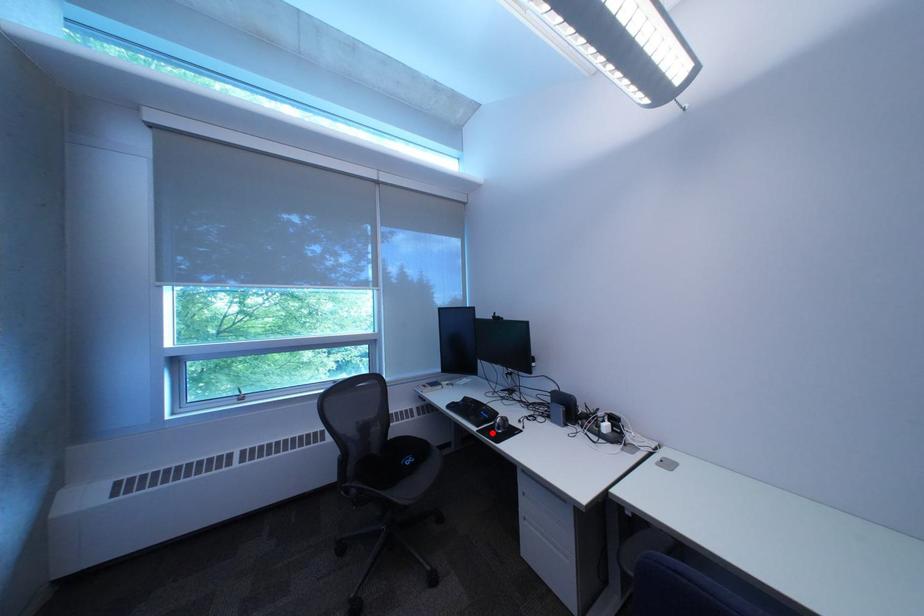
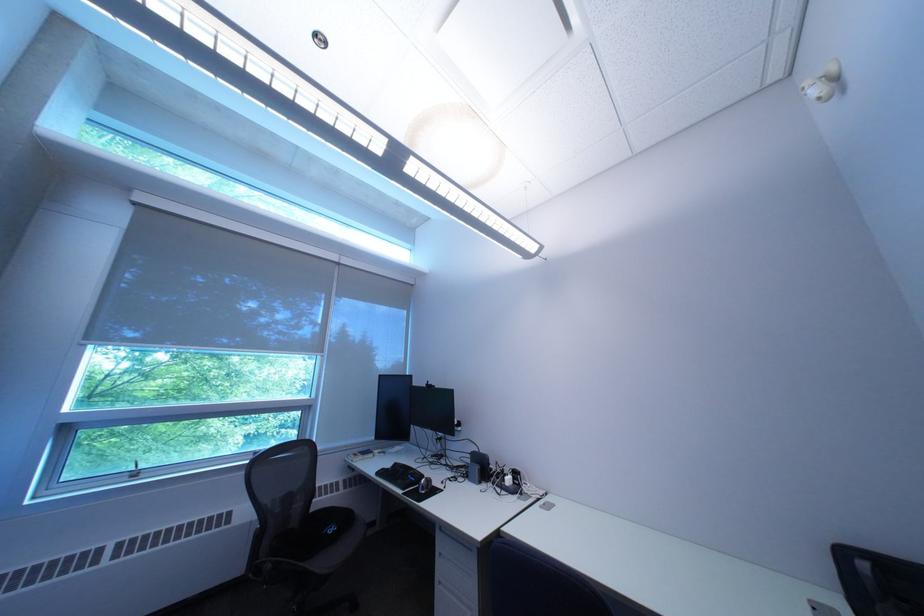
In the second image, find the point that corresponds to the highlighted location in the first image.

(418, 495)